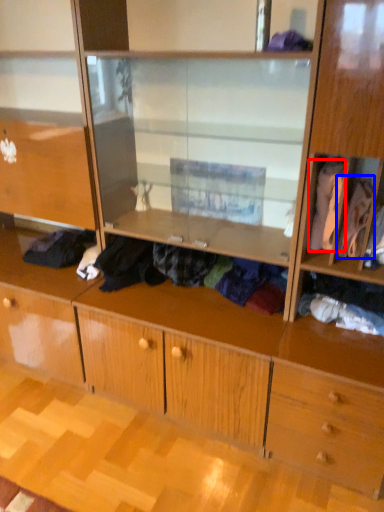
Question: Which object is closer to the camera taking this photo, clothing (highlighted by a red box) or clothing (highlighted by a blue box)?

Choices:
 (A) clothing
 (B) clothing

Answer: (A)